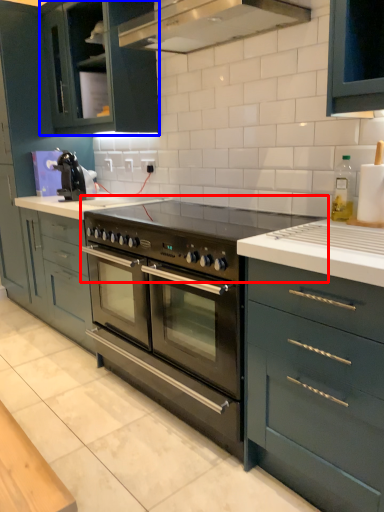
Question: Which object is further to the camera taking this photo, gas stove (highlighted by a red box) or cabinetry (highlighted by a blue box)?

Choices:
 (A) gas stove
 (B) cabinetry

Answer: (B)